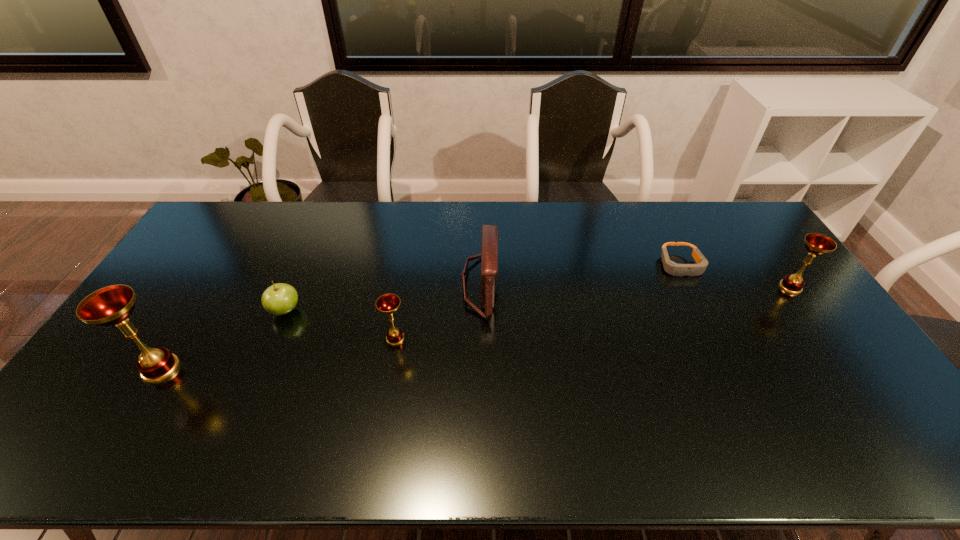
Identify the location of object located in the near left corner section of the desktop. The image size is (960, 540). tap(112, 305).

Locate an element on the screen. The height and width of the screenshot is (540, 960). vacant space at the far edge is located at coordinates (511, 213).

You are a GUI agent. You are given a task and a screenshot of the screen. Output one action in this format:
    pyautogui.click(x=<x>, y=<y>)
    Task: Click on the vacant space at the left edge of the desktop
    The image size is (960, 540).
    Given the screenshot: What is the action you would take?
    pyautogui.click(x=177, y=274)

In the image, there is a desktop. Identify the location of vacant space at the right edge. The height and width of the screenshot is (540, 960). (834, 338).

Where is `free space at the near left corner of the desktop`? This screenshot has width=960, height=540. free space at the near left corner of the desktop is located at coordinates (85, 388).

Identify the location of vacant space at the far right corner of the desktop. (732, 219).

This screenshot has width=960, height=540. In order to click on vacant position at the near right corner of the desktop in this screenshot , I will do `click(846, 411)`.

Identify the location of vacant area between the rightmost object and the apple. Image resolution: width=960 pixels, height=540 pixels. (538, 299).

Locate an element on the screen. free point between the second nearest chalice and the second shortest chalice is located at coordinates (593, 313).

Where is `vacant space in between the shoulder bag and the tallest object`? vacant space in between the shoulder bag and the tallest object is located at coordinates (321, 327).